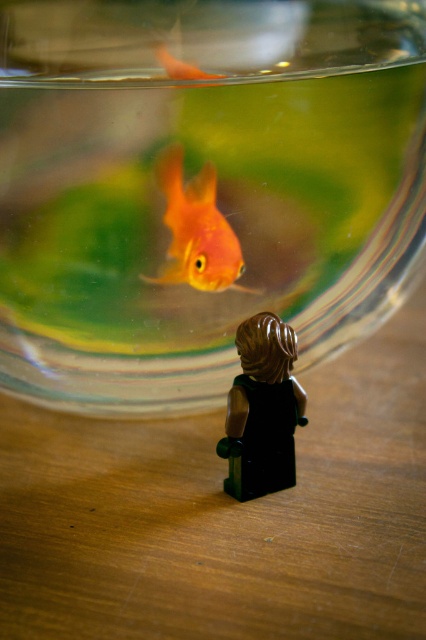
Question: Which point is closer to the camera?

Choices:
 (A) (184, 269)
 (B) (256, 44)

Answer: (B)

Question: Does transparent glass bowl at center have a greater width compared to orange matte/glossy goldfish at upper center?

Choices:
 (A) yes
 (B) no

Answer: (A)

Question: In this image, where is shiny orange fish at center located relative to orange matte/glossy goldfish at upper center?

Choices:
 (A) right
 (B) left

Answer: (A)

Question: Estimate the real-world distances between objects in this image. Which object is farther from the transparent glass bowl at center?

Choices:
 (A) shiny orange fish at center
 (B) orange matte/glossy goldfish at upper center

Answer: (B)

Question: From the image, what is the correct spatial relationship of transparent glass bowl at center in relation to orange matte/glossy goldfish at upper center?

Choices:
 (A) left
 (B) right

Answer: (B)

Question: Estimate the real-world distances between objects in this image. Which object is closer to the transparent glass bowl at center?

Choices:
 (A) orange matte/glossy goldfish at upper center
 (B) shiny orange fish at center

Answer: (B)